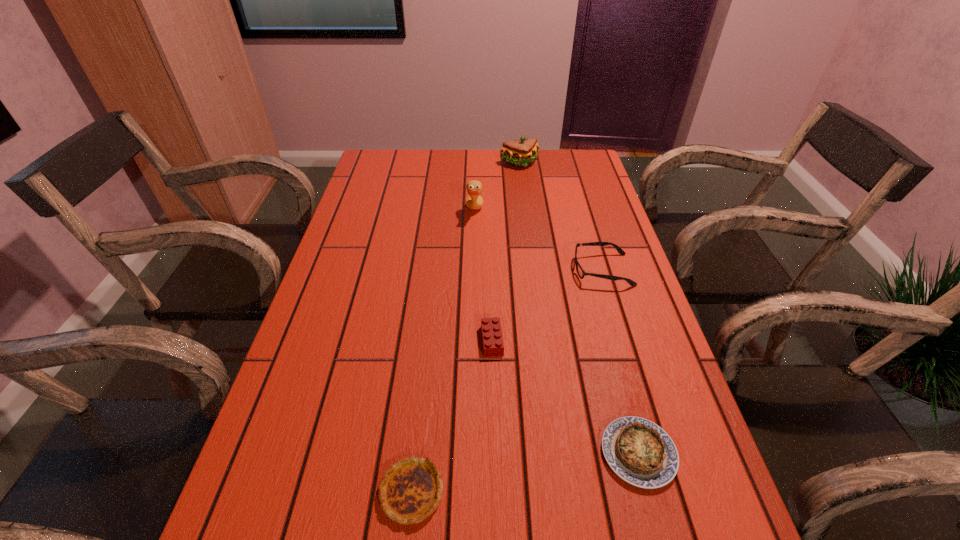
Locate an element on the screen. The width and height of the screenshot is (960, 540). the fourth object from left to right is located at coordinates (521, 153).

Where is `the farthest object`? The width and height of the screenshot is (960, 540). the farthest object is located at coordinates (521, 153).

Locate an element on the screen. the second farthest object is located at coordinates (474, 200).

You are a GUI agent. You are given a task and a screenshot of the screen. Output one action in this format:
    pyautogui.click(x=<x>, y=<y>)
    Task: Click on the third farthest object
    This screenshot has height=540, width=960.
    Given the screenshot: What is the action you would take?
    point(581,273)

The width and height of the screenshot is (960, 540). Find the location of `the third tallest object`. the third tallest object is located at coordinates (581, 273).

Where is `the third shortest object`? Image resolution: width=960 pixels, height=540 pixels. the third shortest object is located at coordinates (493, 345).

The height and width of the screenshot is (540, 960). Identify the location of Lego. (493, 345).

This screenshot has width=960, height=540. What are the coordinates of `the right quiche` in the screenshot? It's located at (640, 452).

You are a GUI agent. You are given a task and a screenshot of the screen. Output one action in this format:
    pyautogui.click(x=<x>, y=<y>)
    Task: Click on the leftmost object
    
    Given the screenshot: What is the action you would take?
    pyautogui.click(x=410, y=491)

Find the location of `free space located 0.090m on the right of the third object from right to left`. free space located 0.090m on the right of the third object from right to left is located at coordinates (565, 164).